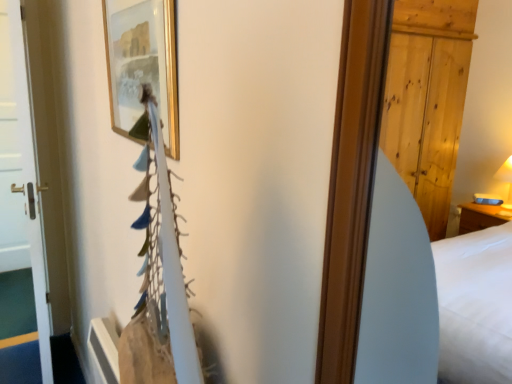
Question: Is gold/gilded picture frame at upper center situated inside white glossy door at left or outside?

Choices:
 (A) outside
 (B) inside

Answer: (A)

Question: In the image, is gold/gilded picture frame at upper center positioned in front of or behind white glossy door at left?

Choices:
 (A) behind
 (B) front

Answer: (B)

Question: Based on their sizes in the image, would you say gold/gilded picture frame at upper center is bigger or smaller than white glossy door at left?

Choices:
 (A) small
 (B) big

Answer: (A)

Question: Based on their positions, is white glossy door at left located to the left or right of gold/gilded picture frame at upper center?

Choices:
 (A) right
 (B) left

Answer: (B)

Question: Is point (0, 119) positioned closer to the camera than point (152, 9)?

Choices:
 (A) farther
 (B) closer

Answer: (A)

Question: In terms of height, does white glossy door at left look taller or shorter compared to gold/gilded picture frame at upper center?

Choices:
 (A) tall
 (B) short

Answer: (A)

Question: Considering their positions, is white glossy door at left located in front of or behind gold/gilded picture frame at upper center?

Choices:
 (A) behind
 (B) front

Answer: (A)